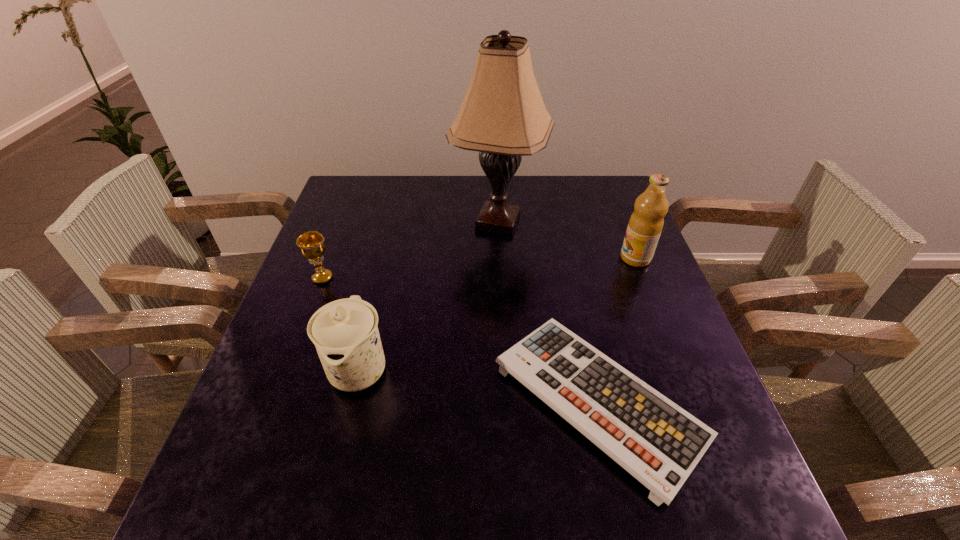
Identify the location of object at the near right corner. (659, 443).

In the image, there is a desktop. Find the location of `vacant space at the far edge`. vacant space at the far edge is located at coordinates (421, 206).

Find the location of `free space at the near edge of the desktop`. free space at the near edge of the desktop is located at coordinates (514, 489).

In the image, there is a desktop. Where is `vacant region at the left edge`? Image resolution: width=960 pixels, height=540 pixels. vacant region at the left edge is located at coordinates (362, 281).

This screenshot has width=960, height=540. Identify the location of vacant position at the right edge of the desktop. (673, 326).

You are a GUI agent. You are given a task and a screenshot of the screen. Output one action in this format:
    pyautogui.click(x=<x>, y=<y>)
    Task: Click on the blank space at the far left corner of the desktop
    The width and height of the screenshot is (960, 540).
    Given the screenshot: What is the action you would take?
    pyautogui.click(x=343, y=183)

In the image, there is a desktop. Where is `free space at the near right corner`? This screenshot has width=960, height=540. free space at the near right corner is located at coordinates (722, 504).

Identify the location of free spot between the olive oil and the third shortest object. (497, 313).

Locate an element on the screen. Image resolution: width=960 pixels, height=540 pixels. free space between the second tallest object and the fourth tallest object is located at coordinates (479, 268).

The image size is (960, 540). I want to click on vacant point located between the lamp and the computer keyboard, so click(x=548, y=311).